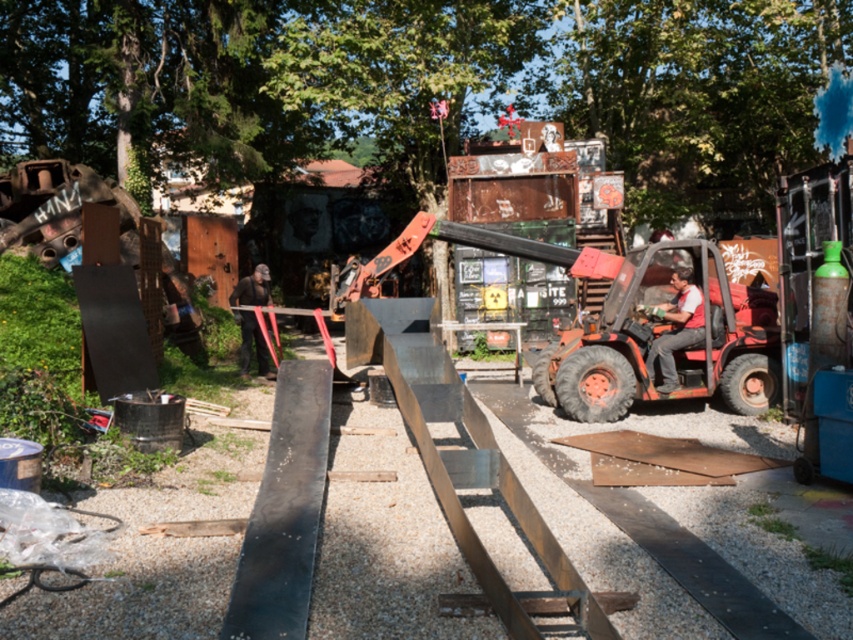
Question: Which point appears closest to the camera in this image?

Choices:
 (A) (248, 324)
 (B) (675, 321)

Answer: (B)

Question: Among these points, which one is farthest from the camera?

Choices:
 (A) (677, 326)
 (B) (247, 339)

Answer: (B)

Question: Does reddish-orange metal forklift at center-right appear on the right side of black matte construction worker at center?

Choices:
 (A) no
 (B) yes

Answer: (B)

Question: Does reddish-orange metal forklift at center-right appear on the right side of black matte construction worker at center?

Choices:
 (A) yes
 (B) no

Answer: (A)

Question: Does reddish-orange metal forklift at center-right lie behind black matte construction worker at center?

Choices:
 (A) no
 (B) yes

Answer: (A)